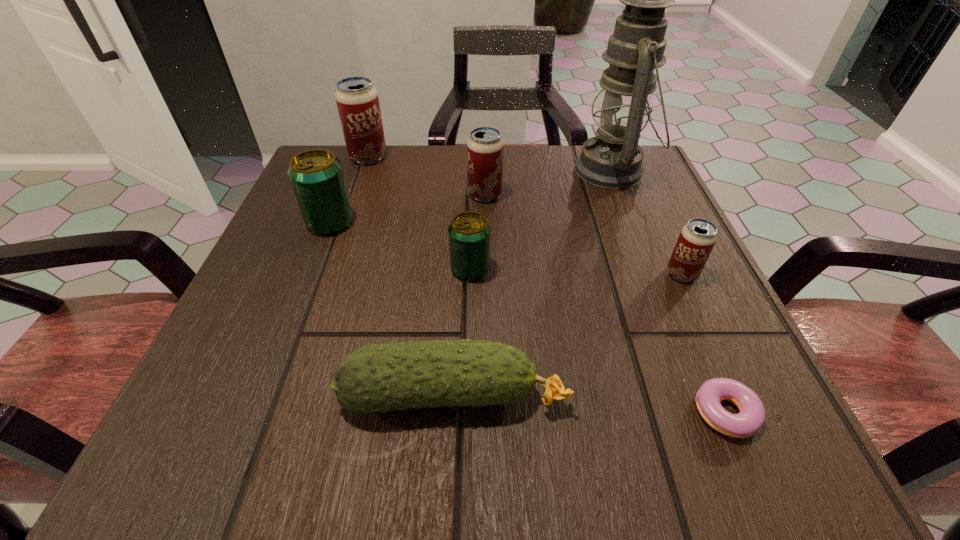
In order to click on object at the far right corner in this screenshot , I will do `click(613, 159)`.

The image size is (960, 540). Identify the location of object at the near right corner. (751, 417).

Where is `free space at the far edge of the desktop`? free space at the far edge of the desktop is located at coordinates (571, 165).

Where is `vacant area at the near edge`? The image size is (960, 540). vacant area at the near edge is located at coordinates (612, 437).

The width and height of the screenshot is (960, 540). In the image, there is a desktop. In order to click on vacant space at the left edge in this screenshot , I will do `click(245, 288)`.

The height and width of the screenshot is (540, 960). Identify the location of free spot at the right edge of the desktop. (719, 296).

Identify the location of free space at the far left corner of the desktop. (365, 174).

Find the location of a particular element. Image resolution: width=960 pixels, height=540 pixels. vacant space at the near left corner of the desktop is located at coordinates (186, 426).

The image size is (960, 540). In order to click on empty space between the shortest object and the farthest red beer can in this screenshot , I will do `click(545, 285)`.

Identify the location of free space that is in between the farthest beer can and the right green beer can. (420, 213).